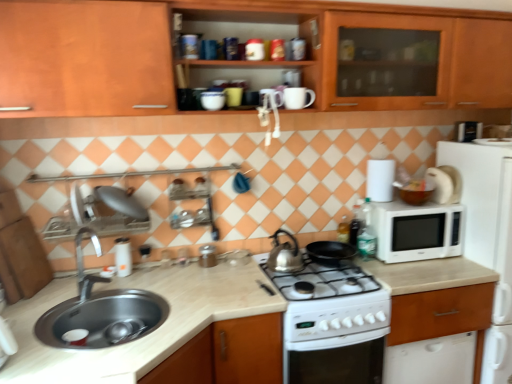
Locate an element on the screen. free space in front of white glossy water filter at left, positioned as the second appliance in top-to-bottom order is located at coordinates 116,281.